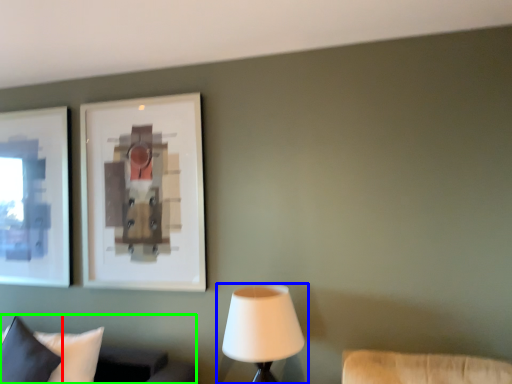
Question: Which is nearer to the pillow (highlighted by a red box)? lamp (highlighted by a blue box) or furniture (highlighted by a green box).

Choices:
 (A) lamp
 (B) furniture

Answer: (B)